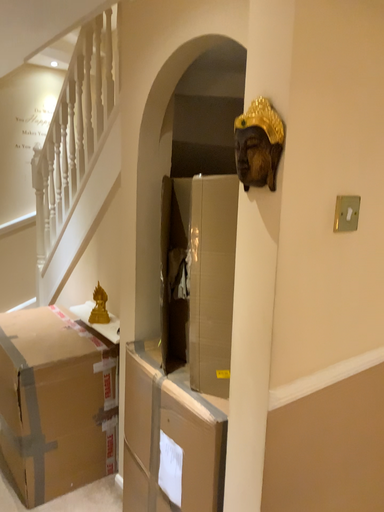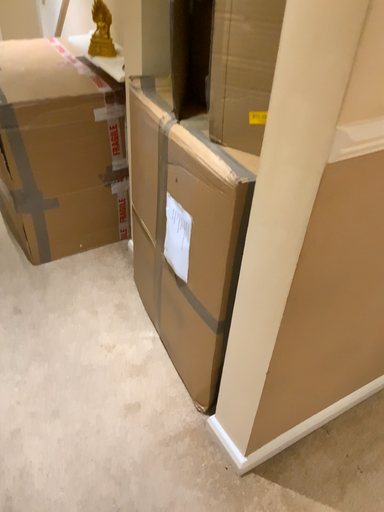
Question: How did the camera likely rotate when shooting the video?

Choices:
 (A) rotated downward
 (B) rotated upward

Answer: (A)